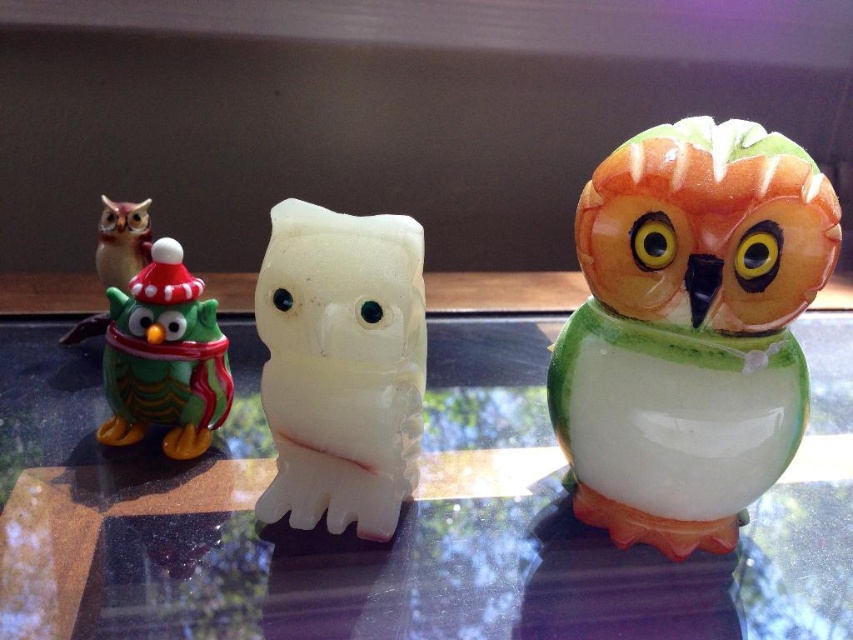
Question: Which point is farther from the camera taking this photo?

Choices:
 (A) (109, 435)
 (B) (820, 524)
 (C) (300, 444)

Answer: (A)

Question: Which point is farther to the camera?

Choices:
 (A) transparent glass table at center
 (B) white glossy owl at center

Answer: (B)

Question: Estimate the real-world distances between objects in this image. Which object is farther from the matte green owl at left?

Choices:
 (A) white glossy owl at center
 (B) matte orange owl at right
 (C) transparent glass table at center

Answer: (B)

Question: Does transparent glass table at center have a lesser width compared to white glossy owl at center?

Choices:
 (A) yes
 (B) no

Answer: (B)

Question: Can you confirm if transparent glass table at center is positioned to the right of white glossy owl at center?

Choices:
 (A) no
 (B) yes

Answer: (B)

Question: Is matte orange owl at right thinner than matte green owl at left?

Choices:
 (A) no
 (B) yes

Answer: (A)